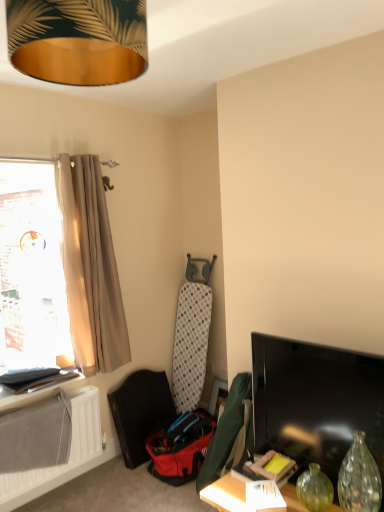
Where is `gold metallic lampshade at upper center`? The width and height of the screenshot is (384, 512). gold metallic lampshade at upper center is located at coordinates (78, 40).

What do you see at coordinates (69, 453) in the screenshot? I see `white matte radiator at lower left` at bounding box center [69, 453].

Measure the distance between translucent beige curtain at left and camera.

translucent beige curtain at left and camera are 2.63 meters apart from each other.

Where is `gold metallic lampshade at upper center`? The width and height of the screenshot is (384, 512). gold metallic lampshade at upper center is located at coordinates (78, 40).

From a real-world perspective, between transparent glass vase at lower right and black glossy tv at right, who is vertically higher?

black glossy tv at right is physically above.

Does transparent glass vase at lower right have a greater width compared to black glossy tv at right?

Indeed, transparent glass vase at lower right has a greater width compared to black glossy tv at right.

Which is more to the left, transparent glass vase at lower right or black glossy tv at right?

Positioned to the left is black glossy tv at right.

Is transparent glass vase at lower right far away from black glossy tv at right?

Actually, transparent glass vase at lower right and black glossy tv at right are a little close together.

From a real-world perspective, is matte green picture frame at lower right located beneath white matte radiator at lower left?

Yes, from a real-world perspective, matte green picture frame at lower right is below white matte radiator at lower left.

Is matte green picture frame at lower right spatially inside white matte radiator at lower left, or outside of it?

matte green picture frame at lower right exists outside the volume of white matte radiator at lower left.

Is point (211, 399) positioned behind point (73, 396)?

Yes, point (211, 399) is farther from viewer.

From the picture: From the image's perspective, between matte green picture frame at lower right and white matte radiator at lower left, who is located below?

white matte radiator at lower left is shown below in the image.

Could white matte radiator at lower left be considered to be inside black textured swivel chair at lower left?

No, white matte radiator at lower left is not a part of black textured swivel chair at lower left.

In terms of height, does black textured swivel chair at lower left look taller or shorter compared to white matte radiator at lower left?

In the image, black textured swivel chair at lower left appears to be taller than white matte radiator at lower left.

Between beige fabric curtain at left and white matte radiator at lower left, which one appears on the right side from the viewer's perspective?

beige fabric curtain at left.

Who is more distant, beige fabric curtain at left or white matte radiator at lower left?

Positioned behind is beige fabric curtain at left.

Is beige fabric curtain at left shorter than white matte radiator at lower left?

Incorrect, the height of beige fabric curtain at left does not fall short of that of white matte radiator at lower left.

Does point (115, 275) come farther from viewer compared to point (89, 430)?

Yes, it is behind point (89, 430).

Could you tell me if black glossy tv at right is turned towards white matte radiator at lower left?

No, black glossy tv at right is not aimed at white matte radiator at lower left.

From the image's perspective, does black glossy tv at right appear lower than white matte radiator at lower left?

Incorrect, from the image's perspective, black glossy tv at right is higher than white matte radiator at lower left.

Can you confirm if black glossy tv at right is wider than white matte radiator at lower left?

In fact, black glossy tv at right might be narrower than white matte radiator at lower left.

Between black glossy tv at right and white matte radiator at lower left, which one is positioned behind?

white matte radiator at lower left is more distant.

Is white matte radiator at lower left inside the boundaries of beige fabric curtain at left, or outside?

white matte radiator at lower left is outside beige fabric curtain at left.

Is white matte radiator at lower left taller or shorter than beige fabric curtain at left?

Considering their sizes, white matte radiator at lower left has less height than beige fabric curtain at left.

At what (x,y) coordinates should I click in order to perform the action: click on radiator located in front of the beige fabric curtain at left. Please return your answer as a coordinate pair (x, y). Image resolution: width=384 pixels, height=512 pixels. Looking at the image, I should click on (69, 453).

Image resolution: width=384 pixels, height=512 pixels. Find the location of `picture frame behind the black textured swivel chair at lower left`. picture frame behind the black textured swivel chair at lower left is located at coordinates (216, 393).

From the image's perspective, between black textured swivel chair at lower left and matte green picture frame at lower right, who is located below?

black textured swivel chair at lower left.

From a real-world perspective, which object stands above the other?

In real-world perspective, black textured swivel chair at lower left is above.

At what (x,y) coordinates should I click in order to perform the action: click on television lying above the transparent glass vase at lower right (from the image's perspective). Please return your answer as a coordinate pair (x, y). This screenshot has height=512, width=384. Looking at the image, I should click on (316, 403).

The width and height of the screenshot is (384, 512). Identify the location of radiator above the matte green picture frame at lower right (from a real-world perspective). (69, 453).

Considering their positions, is translucent beige curtain at left positioned closer to black textured swivel chair at lower left than gold metallic lampshade at upper center?

Among the two, translucent beige curtain at left is located nearer to black textured swivel chair at lower left.

Considering their positions, is gold metallic lampshade at upper center positioned closer to white matte radiator at lower left than black glossy tv at right?

black glossy tv at right is positioned closer to the anchor white matte radiator at lower left.

Estimate the real-world distances between objects in this image. Which object is closer to matte black shelf at lower left, beige fabric curtain at left or matte green picture frame at lower right?

Among the two, beige fabric curtain at left is located nearer to matte black shelf at lower left.

Considering their positions, is black textured swivel chair at lower left positioned closer to beige fabric curtain at left than gold metallic lampshade at upper center?

The object closer to beige fabric curtain at left is black textured swivel chair at lower left.

Based on their spatial positions, is beige fabric curtain at left or translucent beige curtain at left further from black textured swivel chair at lower left?

The object further to black textured swivel chair at lower left is translucent beige curtain at left.

From the image, which object appears to be farther from translucent beige curtain at left, black glossy tv at right or black textured swivel chair at lower left?

black glossy tv at right lies further to translucent beige curtain at left than the other object.

When comparing their distances from beige fabric curtain at left, does white matte radiator at lower left or black glossy tv at right seem closer?

white matte radiator at lower left.

Considering their positions, is translucent beige curtain at left positioned further to matte black shelf at lower left than black glossy tv at right?

Among the two, black glossy tv at right is located further to matte black shelf at lower left.

I want to click on radiator situated between translucent beige curtain at left and transparent glass vase at lower right from left to right, so click(69, 453).

Where is `television located between transparent glass vase at lower right and black textured swivel chair at lower left in the depth direction`? The image size is (384, 512). television located between transparent glass vase at lower right and black textured swivel chair at lower left in the depth direction is located at coordinates (316, 403).

The width and height of the screenshot is (384, 512). I want to click on window that lies between beige fabric curtain at left and white matte radiator at lower left from top to bottom, so click(x=31, y=267).

In order to click on swivel chair situated between matte black shelf at lower left and black glossy tv at right from left to right in this screenshot , I will do `click(140, 412)`.